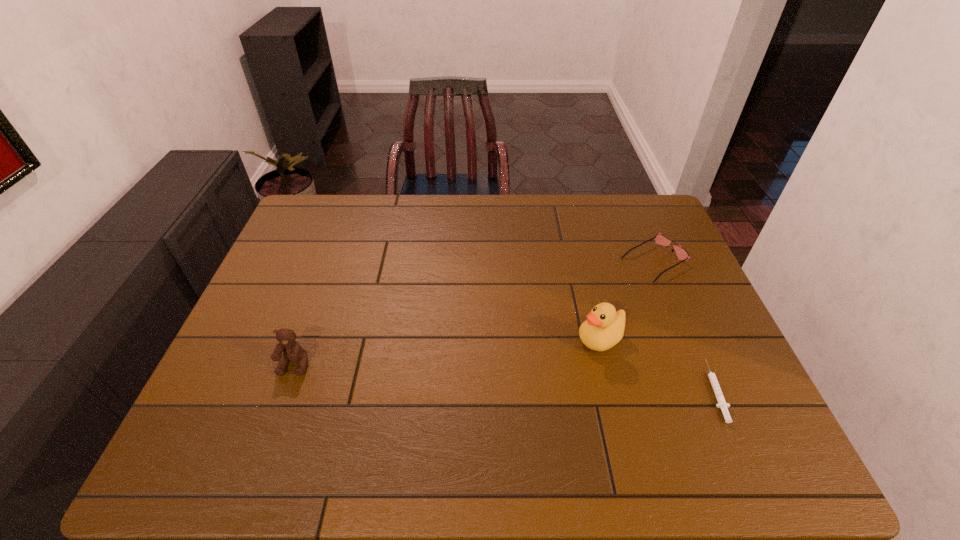
You are a GUI agent. You are given a task and a screenshot of the screen. Output one action in this format:
    pyautogui.click(x=<x>, y=<y>)
    Task: Click on the vacant space on the desktop that is between the leftmost object and the shortest object and is positioned at the beak of the second object from left to right
    The height and width of the screenshot is (540, 960).
    Given the screenshot: What is the action you would take?
    pyautogui.click(x=524, y=379)

This screenshot has width=960, height=540. Find the location of `free space on the desktop that is between the leftmost object and the shortest object and is positioned on the bridge of the farthest object`. free space on the desktop that is between the leftmost object and the shortest object and is positioned on the bridge of the farthest object is located at coordinates (443, 374).